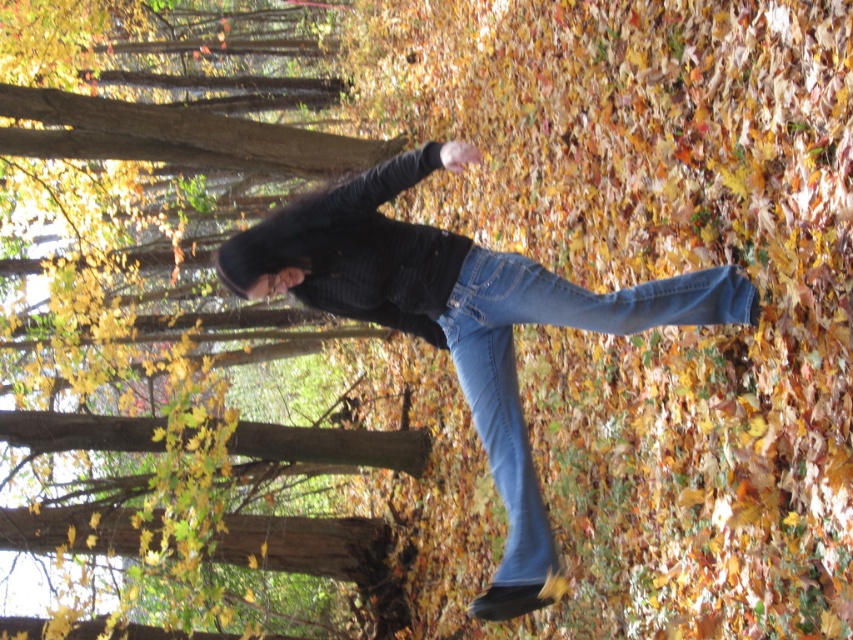
Who is higher up, brown wood tree at center or denim at center?

Answer: brown wood tree at center is higher up.

Is brown wood tree at center to the left of denim at center from the viewer's perspective?

Indeed, brown wood tree at center is positioned on the left side of denim at center.

Is point (82, 465) behind point (517, 516)?

Yes.

Locate an element on the screen. The image size is (853, 640). brown wood tree at center is located at coordinates (138, 260).

Between brown wood tree at center and denim jeans at center, which one is positioned higher?

Positioned higher is brown wood tree at center.

Consider the image. Who is lower down, brown wood tree at center or denim jeans at center?

denim jeans at center is below.

Is point (99, 339) positioned before point (360, 253)?

No, it is not.

This screenshot has width=853, height=640. Find the location of `brown wood tree at center`. brown wood tree at center is located at coordinates (138, 260).

Can you confirm if denim jeans at center is smaller than denim at center?

Actually, denim jeans at center might be larger than denim at center.

Describe the element at coordinates (460, 320) in the screenshot. This screenshot has height=640, width=853. I see `denim jeans at center` at that location.

Locate an element on the screen. This screenshot has width=853, height=640. denim jeans at center is located at coordinates (460, 320).